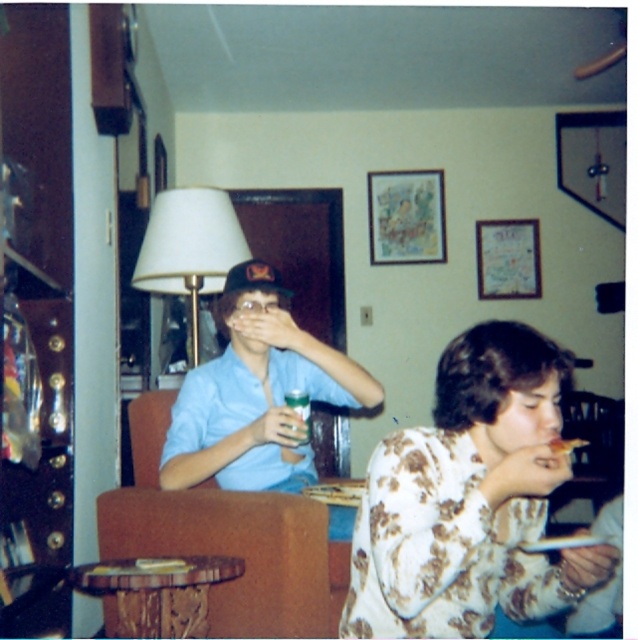
Question: Among these points, which one is nearest to the camera?

Choices:
 (A) (306, 397)
 (B) (160, 192)
 (C) (272, 483)

Answer: (A)

Question: Which of the following is the closest to the observer?

Choices:
 (A) matte blue shirt at center
 (B) white fabric lampshade at upper left
 (C) floral print blouse at lower right

Answer: (C)

Question: Can you confirm if floral print blouse at lower right is positioned below white fabric lampshade at upper left?

Choices:
 (A) yes
 (B) no

Answer: (A)

Question: Can you confirm if matte blue shirt at center is bigger than white paper plate at lower right?

Choices:
 (A) no
 (B) yes

Answer: (A)

Question: Which object is the closest to the white paper plate at lower right?

Choices:
 (A) floral print blouse at lower right
 (B) white fabric lampshade at upper left
 (C) matte blue shirt at center
 (D) green glass beverage at center

Answer: (A)

Question: Does floral print blouse at lower right appear over matte blue shirt at center?

Choices:
 (A) yes
 (B) no

Answer: (B)